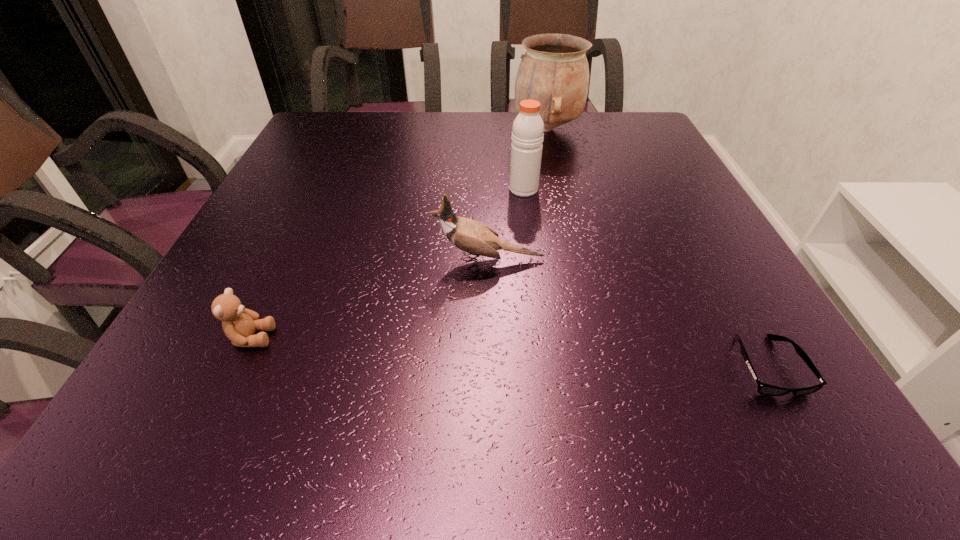
Where is `the farthest object`? the farthest object is located at coordinates (554, 71).

Find the location of a particular element. The height and width of the screenshot is (540, 960). the fourth nearest object is located at coordinates coord(527,132).

Find the location of a particular element. The width and height of the screenshot is (960, 540). bird is located at coordinates (476, 238).

What are the coordinates of `the third tallest object` in the screenshot? It's located at (476, 238).

Locate an element on the screen. the leftmost object is located at coordinates (239, 324).

Find the location of a particular element. teddy bear is located at coordinates (239, 324).

Identify the location of the rightmost object. (765, 389).

Locate an element on the screen. the shortest object is located at coordinates (765, 389).

I want to click on vacant space situated on the left of the farthest object, so click(x=374, y=129).

This screenshot has height=540, width=960. In order to click on free space located on the left of the shaker in this screenshot , I will do `click(409, 189)`.